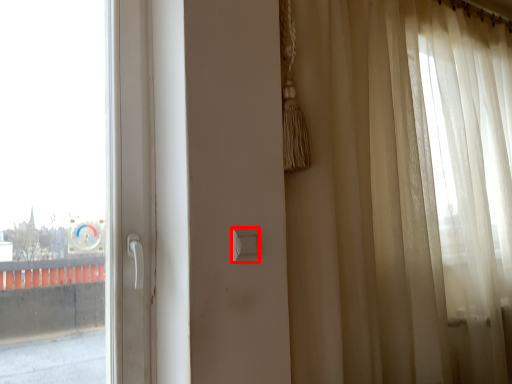
Question: From the image, what is the correct spatial relationship of light switch (annotated by the red box) in relation to curtain?

Choices:
 (A) left
 (B) right

Answer: (A)